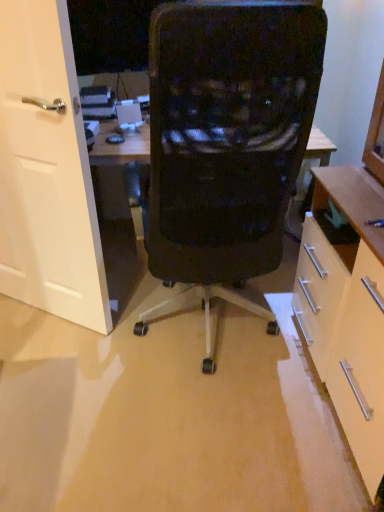
This screenshot has width=384, height=512. In order to click on vacant point to the left of black mesh chair at center in this screenshot , I will do `click(71, 359)`.